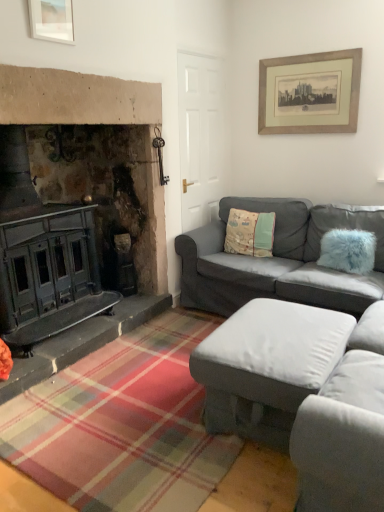
This screenshot has width=384, height=512. What do you see at coordinates (250, 233) in the screenshot?
I see `fluffy fabric pillow at center, placed as the 2th pillow when sorted from front to back` at bounding box center [250, 233].

The image size is (384, 512). Find the location of `gray fabric couch at right, the second studio couch in the front-to-back sequence`. gray fabric couch at right, the second studio couch in the front-to-back sequence is located at coordinates (278, 260).

Are fluffy fabric pillow at center, placed as the 2th pillow when sorted from front to back, and matte gray ottoman at center, acting as the first studio couch starting from the front, beside each other?

No, fluffy fabric pillow at center, placed as the 2th pillow when sorted from front to back, is not next to matte gray ottoman at center, acting as the first studio couch starting from the front.

How many degrees apart are the facing directions of fluffy fabric pillow at center, placed as the 2th pillow when sorted from front to back, and matte gray ottoman at center, acting as the first studio couch starting from the front?

There is a 93.2-degree angle between the facing directions of fluffy fabric pillow at center, placed as the 2th pillow when sorted from front to back, and matte gray ottoman at center, acting as the first studio couch starting from the front.

Considering the sizes of fluffy fabric pillow at center, arranged as the 2th pillow when viewed from the right, and matte gray ottoman at center, which is the second studio couch from back to front, in the image, is fluffy fabric pillow at center, arranged as the 2th pillow when viewed from the right, taller or shorter than matte gray ottoman at center, which is the second studio couch from back to front,?

Clearly, fluffy fabric pillow at center, arranged as the 2th pillow when viewed from the right, is taller compared to matte gray ottoman at center, which is the second studio couch from back to front.

Is point (331, 241) closer to viewer compared to point (237, 252)?

That is True.

Looking at this image, who is shorter, fuzzy blue pillow at right, positioned as the 1th pillow in right-to-left order, or fluffy fabric pillow at center, arranged as the 2th pillow when viewed from the right?

fuzzy blue pillow at right, positioned as the 1th pillow in right-to-left order.

Could you tell me if fuzzy blue pillow at right, positioned as the 1th pillow in right-to-left order, is turned towards fluffy fabric pillow at center, placed as the 2th pillow when sorted from front to back?

No, fuzzy blue pillow at right, positioned as the 1th pillow in right-to-left order, is not oriented towards fluffy fabric pillow at center, placed as the 2th pillow when sorted from front to back.

From the image's perspective, between fuzzy blue pillow at right, which is the 2th pillow in left-to-right order, and fluffy fabric pillow at center, placed as the 2th pillow when sorted from front to back, which one is located above?

fluffy fabric pillow at center, placed as the 2th pillow when sorted from front to back.

Between point (323, 69) and point (330, 254), which one is positioned behind?

The point (323, 69) is farther.

Can you tell me how much beige wooden picture frame at upper right, marked as the 2th picture frame in a front-to-back arrangement, and fuzzy blue pillow at right, the second pillow in the back-to-front sequence, differ in facing direction?

The angular difference between beige wooden picture frame at upper right, marked as the 2th picture frame in a front-to-back arrangement, and fuzzy blue pillow at right, the second pillow in the back-to-front sequence, is 3.42 degrees.

Does beige wooden picture frame at upper right, the 1th picture frame in the right-to-left sequence, appear on the right side of fuzzy blue pillow at right, positioned as the 1th pillow in right-to-left order?

No, beige wooden picture frame at upper right, the 1th picture frame in the right-to-left sequence, is not to the right of fuzzy blue pillow at right, positioned as the 1th pillow in right-to-left order.

Is beige wooden picture frame at upper right, acting as the 1th picture frame starting from the back, surrounding fuzzy blue pillow at right, the second pillow in the back-to-front sequence?

That's incorrect, fuzzy blue pillow at right, the second pillow in the back-to-front sequence, is not inside beige wooden picture frame at upper right, acting as the 1th picture frame starting from the back.

Considering the sizes of gray fabric couch at right, placed as the 1th studio couch when sorted from back to front, and fluffy fabric pillow at center, placed as the 2th pillow when sorted from front to back, in the image, is gray fabric couch at right, placed as the 1th studio couch when sorted from back to front, bigger or smaller than fluffy fabric pillow at center, placed as the 2th pillow when sorted from front to back,?

Considering their sizes, gray fabric couch at right, placed as the 1th studio couch when sorted from back to front, takes up more space than fluffy fabric pillow at center, placed as the 2th pillow when sorted from front to back.

From a real-world perspective, count 2nd pillows upward from the gray fabric couch at right, placed as the 1th studio couch when sorted from back to front, and point to it. Please provide its 2D coordinates.

[(250, 233)]

Is fluffy fabric pillow at center, the 1th pillow when ordered from back to front, surrounded by gray fabric couch at right, placed as the 1th studio couch when sorted from back to front?

That's correct, fluffy fabric pillow at center, the 1th pillow when ordered from back to front, is inside gray fabric couch at right, placed as the 1th studio couch when sorted from back to front.

Considering the relative positions of gray fabric couch at right, the second studio couch in the front-to-back sequence, and fluffy fabric pillow at center, placed as the 2th pillow when sorted from front to back, in the image provided, is gray fabric couch at right, the second studio couch in the front-to-back sequence, behind fluffy fabric pillow at center, placed as the 2th pillow when sorted from front to back,?

No, gray fabric couch at right, the second studio couch in the front-to-back sequence, is closer to the viewer.

Relative to fuzzy blue pillow at right, positioned as the 1th pillow in right-to-left order, is matte white picture frame at upper left, which appears as the 1th picture frame when viewed from the front, in front or behind?

Visually, matte white picture frame at upper left, which appears as the 1th picture frame when viewed from the front, is located in front of fuzzy blue pillow at right, positioned as the 1th pillow in right-to-left order.

From the image's perspective, who appears lower, matte white picture frame at upper left, the 1th picture frame from the left, or fuzzy blue pillow at right, the second pillow in the back-to-front sequence?

fuzzy blue pillow at right, the second pillow in the back-to-front sequence, from the image's perspective.

In the scene shown: Is matte white picture frame at upper left, which appears as the 1th picture frame when viewed from the front, facing away from fuzzy blue pillow at right, positioned as the 1th pillow in right-to-left order?

No, fuzzy blue pillow at right, positioned as the 1th pillow in right-to-left order, is not at the back of matte white picture frame at upper left, which appears as the 1th picture frame when viewed from the front.

Which is more to the left, matte white picture frame at upper left, which appears as the 1th picture frame when viewed from the front, or fuzzy blue pillow at right, the second pillow in the back-to-front sequence?

From the viewer's perspective, matte white picture frame at upper left, which appears as the 1th picture frame when viewed from the front, appears more on the left side.

Based on their positions, is fuzzy blue pillow at right, positioned as the 1th pillow in right-to-left order, located to the left or right of gray fabric couch at right, placed as the 1th studio couch when sorted from back to front?

fuzzy blue pillow at right, positioned as the 1th pillow in right-to-left order, is to the right of gray fabric couch at right, placed as the 1th studio couch when sorted from back to front.

From the image's perspective, who appears lower, fuzzy blue pillow at right, which is the 2th pillow in left-to-right order, or gray fabric couch at right, the second studio couch in the front-to-back sequence?

From the image's view, gray fabric couch at right, the second studio couch in the front-to-back sequence, is below.

Is fuzzy blue pillow at right, which is the 2th pillow in left-to-right order, located outside gray fabric couch at right, the second studio couch in the front-to-back sequence?

No.

Between fuzzy blue pillow at right, positioned as the 1th pillow in right-to-left order, and matte white picture frame at upper left, the 1th picture frame from the left, which one is positioned behind?

fuzzy blue pillow at right, positioned as the 1th pillow in right-to-left order.

From the image's perspective, which one is positioned higher, fuzzy blue pillow at right, the second pillow in the back-to-front sequence, or matte white picture frame at upper left, which is counted as the second picture frame, starting from the right?

matte white picture frame at upper left, which is counted as the second picture frame, starting from the right, appears higher in the image.

Is fuzzy blue pillow at right, positioned as the 1th pillow in right-to-left order, completely or partially outside of matte white picture frame at upper left, which is counted as the 2th picture frame, starting from the back?

Yes, fuzzy blue pillow at right, positioned as the 1th pillow in right-to-left order, is not within matte white picture frame at upper left, which is counted as the 2th picture frame, starting from the back.

Locate an element on the screen. This screenshot has height=512, width=384. the 2nd studio couch located beneath the fluffy fabric pillow at center, arranged as the 2th pillow when viewed from the right (from a real-world perspective) is located at coordinates (304, 394).

Where is `pillow on the left of fuzzy blue pillow at right, which is the 2th pillow in left-to-right order`? pillow on the left of fuzzy blue pillow at right, which is the 2th pillow in left-to-right order is located at coordinates (250, 233).

From the image, which object appears to be nearer to fuzzy blue pillow at right, positioned as the 1th pillow in right-to-left order, gray fabric couch at right, placed as the 1th studio couch when sorted from back to front, or fluffy fabric pillow at center, placed as the 2th pillow when sorted from front to back?

Based on the image, gray fabric couch at right, placed as the 1th studio couch when sorted from back to front, appears to be nearer to fuzzy blue pillow at right, positioned as the 1th pillow in right-to-left order.

Considering their positions, is fuzzy blue pillow at right, the second pillow in the back-to-front sequence, positioned closer to matte white picture frame at upper left, which is counted as the 2th picture frame, starting from the back, than matte gray ottoman at center, which is the second studio couch from back to front?

matte gray ottoman at center, which is the second studio couch from back to front, is closer to matte white picture frame at upper left, which is counted as the 2th picture frame, starting from the back.

Which object lies further to the anchor point fluffy fabric pillow at center, the 1th pillow when ordered from back to front, gray fabric couch at right, the second studio couch in the front-to-back sequence, or fuzzy blue pillow at right, the second pillow in the back-to-front sequence?

fuzzy blue pillow at right, the second pillow in the back-to-front sequence, is positioned further to the anchor fluffy fabric pillow at center, the 1th pillow when ordered from back to front.

Looking at the image, which one is located closer to matte white picture frame at upper left, which is counted as the 2th picture frame, starting from the back, fuzzy blue pillow at right, which is the 2th pillow in left-to-right order, or gray fabric couch at right, the second studio couch in the front-to-back sequence?

gray fabric couch at right, the second studio couch in the front-to-back sequence, lies closer to matte white picture frame at upper left, which is counted as the 2th picture frame, starting from the back, than the other object.

Considering their positions, is matte white picture frame at upper left, the 1th picture frame from the left, positioned further to fuzzy blue pillow at right, the second pillow in the back-to-front sequence, than beige wooden picture frame at upper right, marked as the 2th picture frame in a front-to-back arrangement?

matte white picture frame at upper left, the 1th picture frame from the left, is positioned further to the anchor fuzzy blue pillow at right, the second pillow in the back-to-front sequence.

Which object lies nearer to the anchor point matte gray ottoman at center, which is the second studio couch from back to front, gray fabric couch at right, the second studio couch in the front-to-back sequence, or beige wooden picture frame at upper right, acting as the 1th picture frame starting from the back?

The object closer to matte gray ottoman at center, which is the second studio couch from back to front, is gray fabric couch at right, the second studio couch in the front-to-back sequence.

Considering their positions, is matte white picture frame at upper left, which appears as the 1th picture frame when viewed from the front, positioned closer to fluffy fabric pillow at center, placed as the 2th pillow when sorted from front to back, than gray fabric couch at right, the second studio couch in the front-to-back sequence?

gray fabric couch at right, the second studio couch in the front-to-back sequence, is closer to fluffy fabric pillow at center, placed as the 2th pillow when sorted from front to back.

Based on their spatial positions, is beige wooden picture frame at upper right, marked as the 2th picture frame in a front-to-back arrangement, or gray fabric couch at right, the second studio couch in the front-to-back sequence, closer to matte white picture frame at upper left, which is counted as the 2th picture frame, starting from the back?

gray fabric couch at right, the second studio couch in the front-to-back sequence.

You are a GUI agent. You are given a task and a screenshot of the screen. Output one action in this format:
    pyautogui.click(x=<x>, y=<y>)
    Task: Click on the studio couch between beige wooden picture frame at upper right, the 1th picture frame in the right-to-left sequence, and matte gray ottoman at center, acting as the first studio couch starting from the front, from top to bottom
    This screenshot has width=384, height=512.
    Given the screenshot: What is the action you would take?
    pyautogui.click(x=278, y=260)

This screenshot has width=384, height=512. What are the coordinates of `studio couch between matte gray ottoman at center, which is the second studio couch from back to front, and fuzzy blue pillow at right, which is the 2th pillow in left-to-right order, from front to back` in the screenshot? It's located at (278, 260).

The width and height of the screenshot is (384, 512). I want to click on pillow between beige wooden picture frame at upper right, marked as the 2th picture frame in a front-to-back arrangement, and fuzzy blue pillow at right, which is the 2th pillow in left-to-right order, from top to bottom, so click(250, 233).

This screenshot has height=512, width=384. In order to click on picture frame between beige wooden picture frame at upper right, acting as the 1th picture frame starting from the back, and matte gray ottoman at center, acting as the first studio couch starting from the front, from top to bottom in this screenshot , I will do `click(52, 20)`.